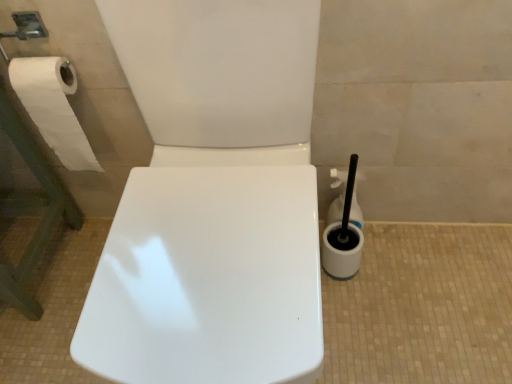
Question: From a real-world perspective, relative to white plastic toilet brush at right, the second cleaning product viewed from the back, is white paper at left vertically above or below?

Choices:
 (A) below
 (B) above

Answer: (B)

Question: Is point (56, 124) positioned closer to the camera than point (335, 271)?

Choices:
 (A) farther
 (B) closer

Answer: (B)

Question: Based on their relative distances, which object is nearer to the white paper at left?

Choices:
 (A) white plastic toilet brush at right, which is the 1th cleaning product from front to back
 (B) white plastic cleaning product at right, which ranks as the second cleaning product in front-to-back order

Answer: (B)

Question: Considering the real-world distances, which object is farthest from the white plastic toilet brush at right, the second cleaning product viewed from the back?

Choices:
 (A) white plastic cleaning product at right, the first cleaning product viewed from the back
 (B) white paper at left

Answer: (B)